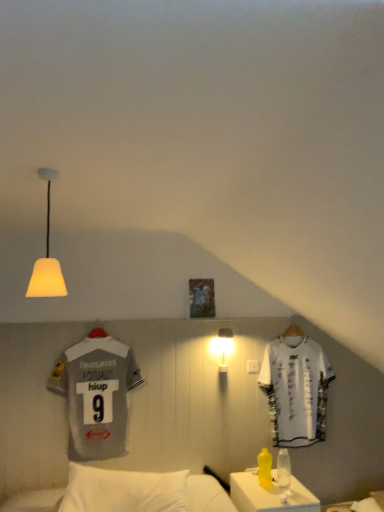
The width and height of the screenshot is (384, 512). Identify the location of free space in front of yellow translucent bottle at lower right, the second bottle positioned from the left. tap(294, 496).